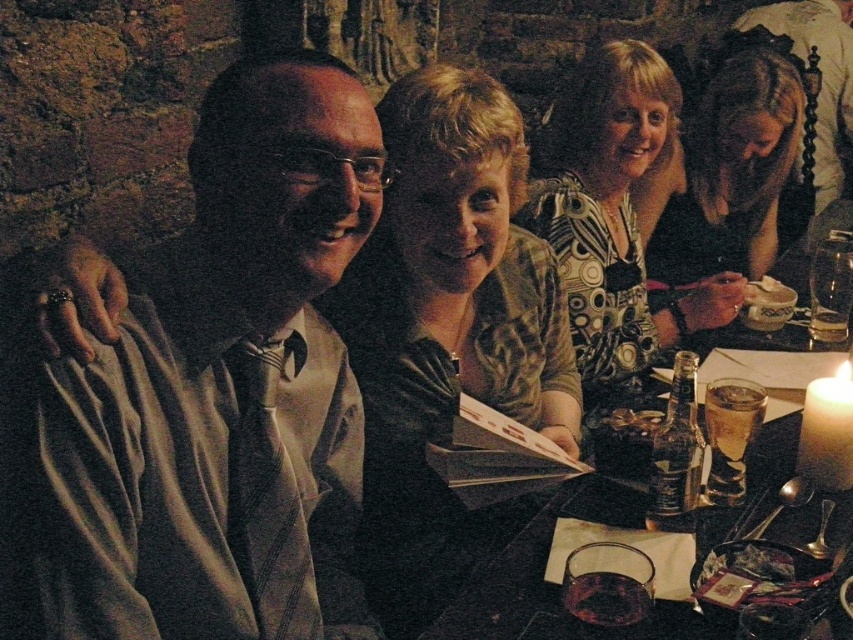
You are a photographer trying to capture a candid shot of the blonde hair at upper right and the translucent glass at lower center. Which object is wider in the image?

The blonde hair at upper right is wider than the translucent glass at lower center.

You are a waiter in a restaurant and need to place a small dessert plate between the two translucent glasses. Which glass should you place it closer to? The translucent glass at lower center or the translucent glass at table right?

The translucent glass at lower center is located below the translucent glass at table right. Since the dessert plate needs to be placed between them, it should be positioned closer to the translucent glass at table right to maintain proper spacing.

You are a waiter in a restaurant and need to place a tall drink on the table. Which of the two translucent glasses, the translucent glass at lower center or the translucent glass at table right, would be more suitable for the drink to prevent it from tipping over?

The translucent glass at table right is taller than the translucent glass at lower center, making it more stable and suitable for holding a tall drink without tipping over.